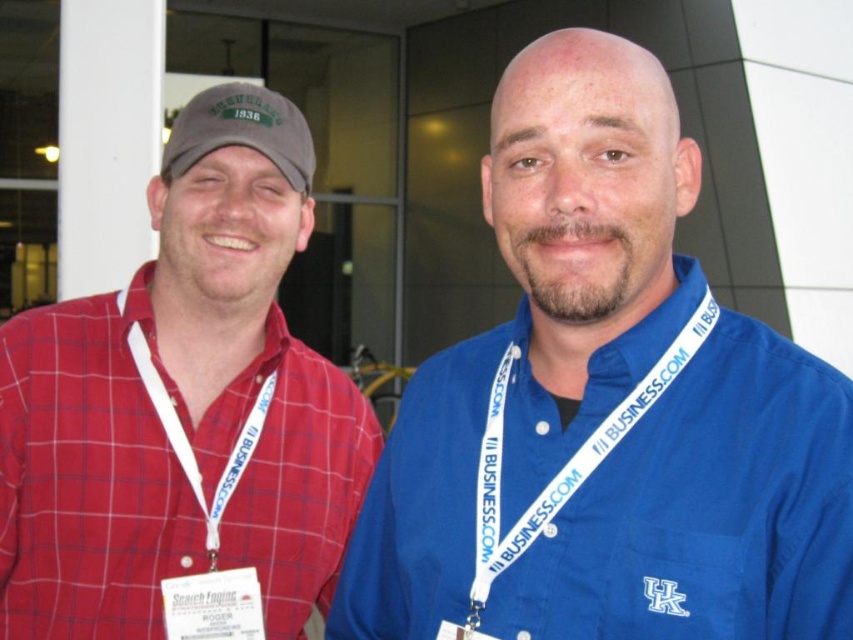
You are standing in front of the building with large glass windows. You see two points marked in the image. Which point is closer to you, point (311,589) or point (474,604)?

Point (311,589) is closer to you than point (474,604) because it is further to the viewer.